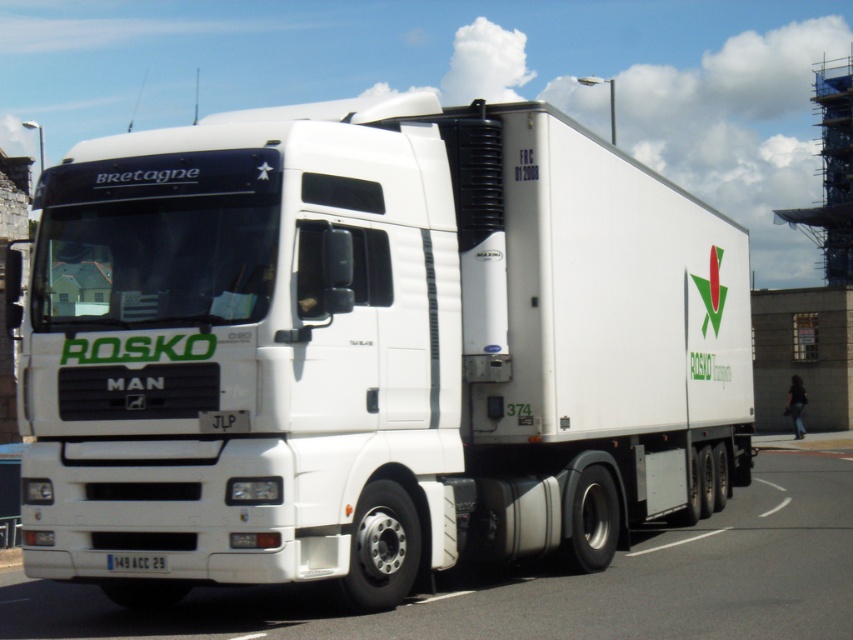
You are a GUI agent. You are given a task and a screenshot of the screen. Output one action in this format:
    pyautogui.click(x=<x>, y=<y>)
    Task: Click on the white glossy truck at center
    
    Given the screenshot: What is the action you would take?
    pyautogui.click(x=548, y=582)

Measure the distance between white glossy truck at center and white plastic license plate at bottom center.

2.83 meters

What do you see at coordinates (548, 582) in the screenshot? Image resolution: width=853 pixels, height=640 pixels. I see `white glossy truck at center` at bounding box center [548, 582].

Locate an element on the screen. white glossy truck at center is located at coordinates (548, 582).

Is white matte truck at center positioned behind white glossy truck at center?

That is True.

Is point (312, 317) less distant than point (302, 593)?

That is True.

Measure the distance between point [123,291] and camera.

Point [123,291] and camera are 8.16 meters apart from each other.

Locate an element on the screen. white matte truck at center is located at coordinates (370, 349).

Who is shorter, white matte truck at center or white plastic license plate at bottom center?

white plastic license plate at bottom center

Can you confirm if white matte truck at center is positioned above white plastic license plate at bottom center?

Correct, white matte truck at center is located above white plastic license plate at bottom center.

I want to click on white matte truck at center, so [x=370, y=349].